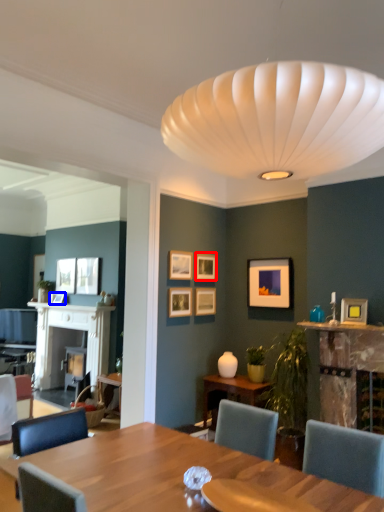
Question: Which object appears farthest to the camera in this image, picture frame (highlighted by a red box) or picture frame (highlighted by a blue box)?

Choices:
 (A) picture frame
 (B) picture frame

Answer: (B)